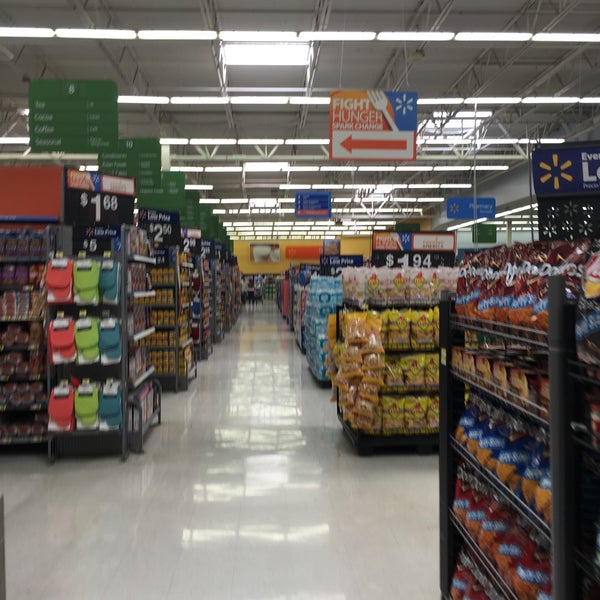
Locate an element on the screen. The width and height of the screenshot is (600, 600). whiny white tiled flooring is located at coordinates (258, 408), (28, 505), (408, 504).